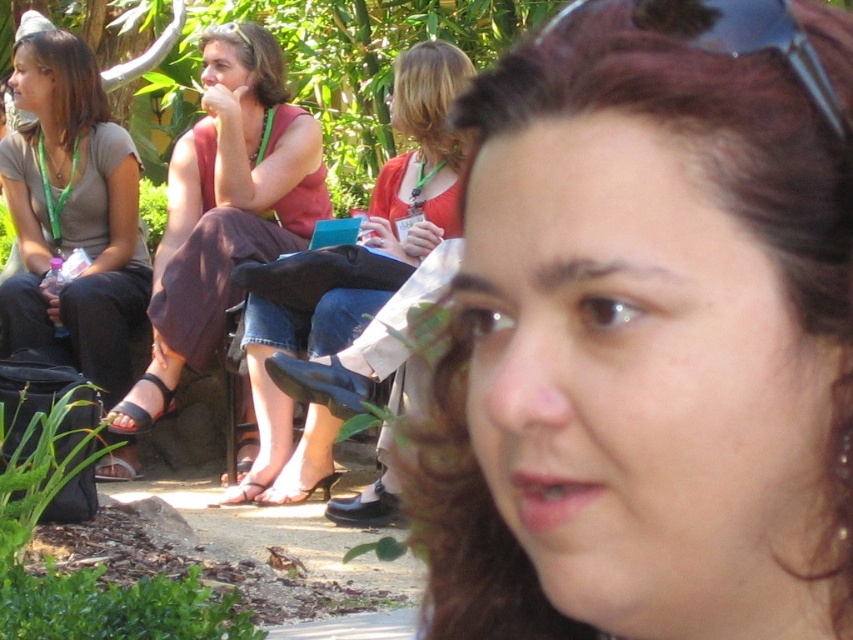
What are the coordinates of `brown hair at center` in the screenshot? It's located at (645, 340).

From the picture: Who is more forward, (648, 449) or (276, 337)?

Point (648, 449) is in front.

Which is in front, point (830, 179) or point (270, 388)?

Point (830, 179) is more forward.

Identify the location of brown hair at center. Image resolution: width=853 pixels, height=640 pixels. (645, 340).

Does matte pink dress at center have a smaller size compared to matte gray shirt at left?

No.

Describe the element at coordinates (225, 209) in the screenshot. The width and height of the screenshot is (853, 640). I see `matte pink dress at center` at that location.

Locate an element on the screen. This screenshot has height=640, width=853. matte pink dress at center is located at coordinates point(225,209).

Is point (123, 326) positioned in front of point (820, 88)?

No, it is not.

Does matte gray shirt at left appear on the left side of transparent plastic goggles at upper center?

Correct, you'll find matte gray shirt at left to the left of transparent plastic goggles at upper center.

Is point (123, 193) positioned in front of point (844, 128)?

No.

Identify the location of matte gray shirt at left. Image resolution: width=853 pixels, height=640 pixels. (73, 214).